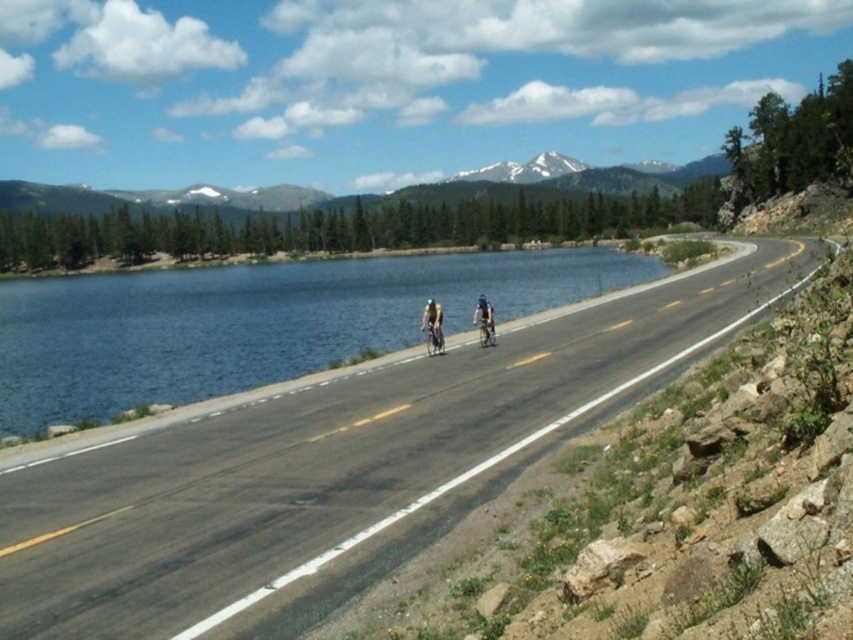
At what (x,y) coordinates should I click in order to perform the action: click on asphalt road at center. Please return your answer as a coordinate pair (x, y). The image size is (853, 640). Looking at the image, I should click on (335, 468).

This screenshot has width=853, height=640. Identify the location of asphalt road at center. (335, 468).

Which of these two, asphalt road at center or shiny metallic bicycle at center, stands shorter?

shiny metallic bicycle at center

Is asphalt road at center positioned at the back of shiny metallic bicycle at center?

→ No, it is in front of shiny metallic bicycle at center.

Where is `asphalt road at center`? asphalt road at center is located at coordinates (335, 468).

Does asphalt road at center appear on the right side of matte black bicycle at center?

Correct, you'll find asphalt road at center to the right of matte black bicycle at center.

Is asphalt road at center smaller than matte black bicycle at center?

Incorrect, asphalt road at center is not smaller in size than matte black bicycle at center.

Who is more forward, (677, 344) or (422, 330)?

Positioned in front is point (677, 344).

The height and width of the screenshot is (640, 853). I want to click on asphalt road at center, so click(x=335, y=468).